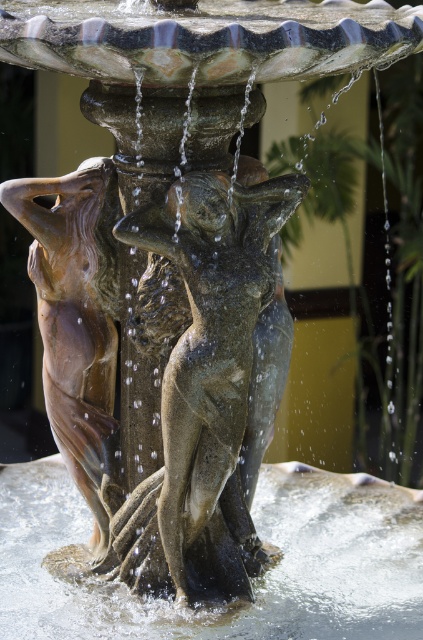
Question: Which point appears farthest from the camera in this image?

Choices:
 (A) (14, 481)
 (B) (192, 196)

Answer: (A)

Question: Is bronze statue at center to the right of clear water at base center from the viewer's perspective?

Choices:
 (A) yes
 (B) no

Answer: (B)

Question: Which point is closer to the camera?

Choices:
 (A) clear water at base center
 (B) bronze statue at center

Answer: (B)

Question: Is bronze statue at center below clear water at base center?

Choices:
 (A) yes
 (B) no

Answer: (B)

Question: Does bronze statue at center have a smaller size compared to clear water at base center?

Choices:
 (A) no
 (B) yes

Answer: (B)

Question: Which object is farther from the camera taking this photo?

Choices:
 (A) clear water at base center
 (B) bronze statue at center

Answer: (A)